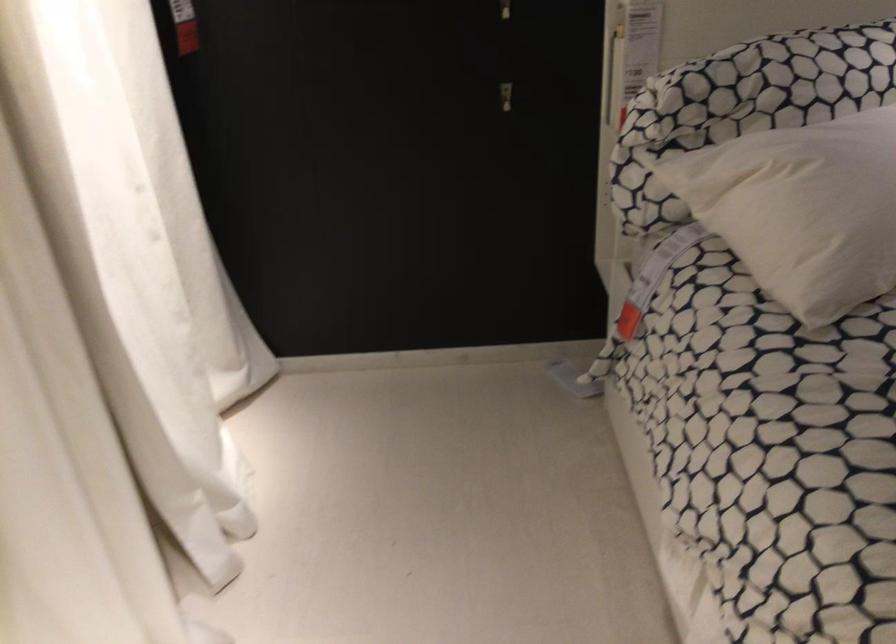
Locate an element on the screen. This screenshot has height=644, width=896. white pillow is located at coordinates (802, 209).